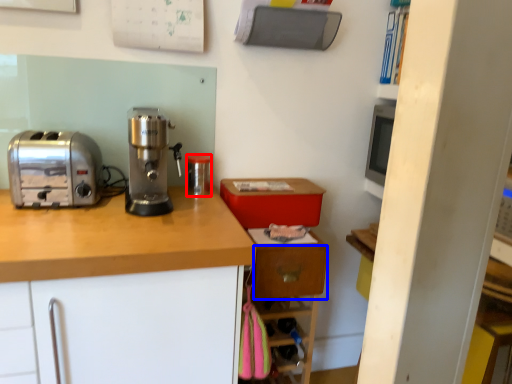
Question: Among these objects, which one is nearest to the camera, kitchen appliance (highlighted by a red box) or drawer (highlighted by a blue box)?

Choices:
 (A) kitchen appliance
 (B) drawer

Answer: (B)